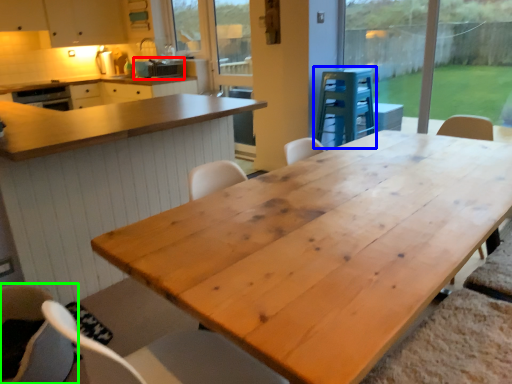
Question: Estimate the real-world distances between objects in this image. Which object is closer to appliance (highlighted by a red box), appliance (highlighted by a blue box) or chair (highlighted by a green box)?

Choices:
 (A) appliance
 (B) chair

Answer: (A)